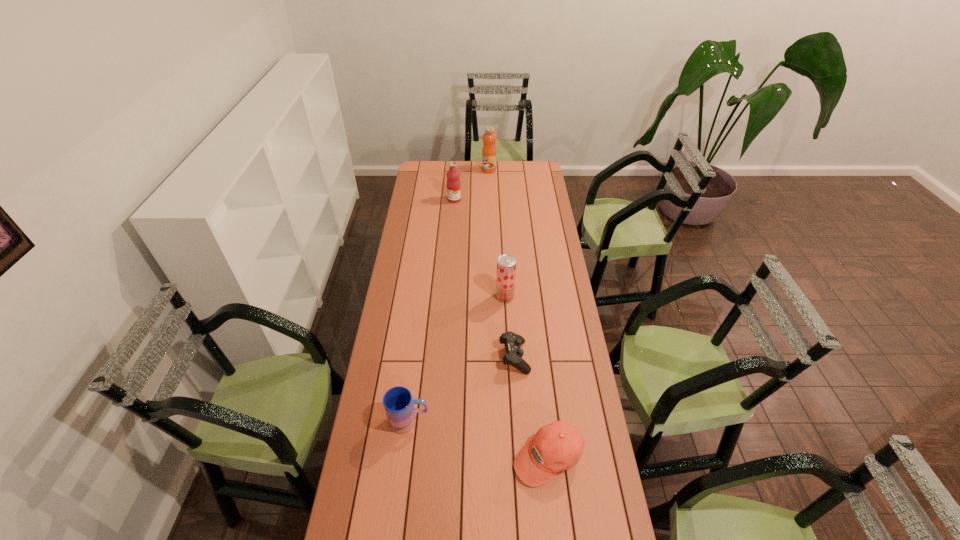
Where is `free space located on the label of the leftmost fruit juice`? free space located on the label of the leftmost fruit juice is located at coordinates (498, 199).

Where is `free location located 0.220m on the back of the third farthest object`? The image size is (960, 540). free location located 0.220m on the back of the third farthest object is located at coordinates (503, 258).

This screenshot has height=540, width=960. Find the location of `vacant space situated on the side of the mug with the handle`. vacant space situated on the side of the mug with the handle is located at coordinates (528, 421).

What are the coordinates of `free region located 0.200m on the left of the baseball cap` in the screenshot? It's located at (452, 456).

You are a GUI agent. You are given a task and a screenshot of the screen. Output one action in this format:
    pyautogui.click(x=<x>, y=<y>)
    Task: Click on the vacant space located 0.130m on the front of the control
    
    Given the screenshot: What is the action you would take?
    pyautogui.click(x=517, y=407)

Where is `object that is at the far edge`? object that is at the far edge is located at coordinates (489, 137).

Identify the location of object present at the left edge. (398, 403).

The height and width of the screenshot is (540, 960). I want to click on object positioned at the right edge, so click(557, 446).

The width and height of the screenshot is (960, 540). Find the location of `blank space at the left edge`. blank space at the left edge is located at coordinates (399, 383).

Locate an element on the screen. This screenshot has height=540, width=960. vacant space at the right edge of the desktop is located at coordinates (551, 291).